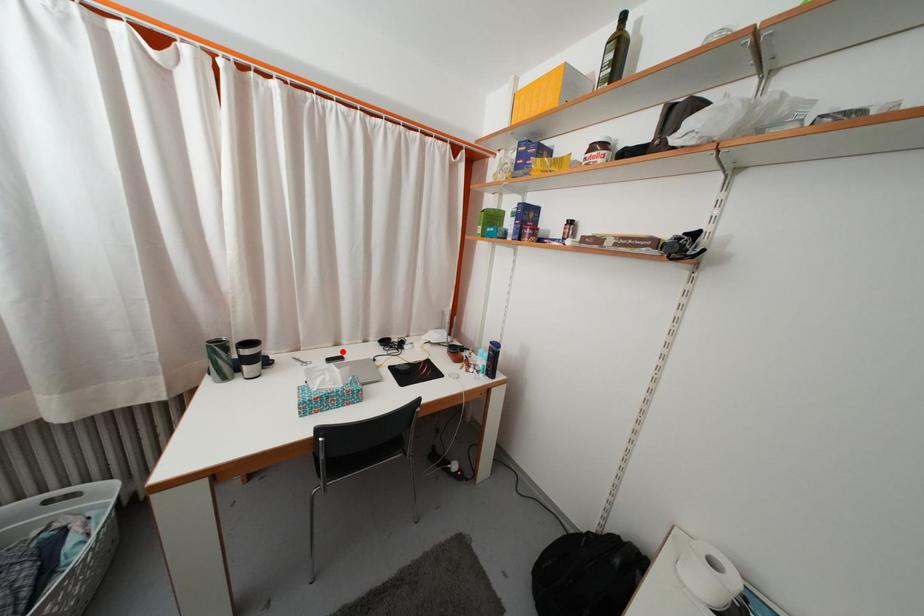
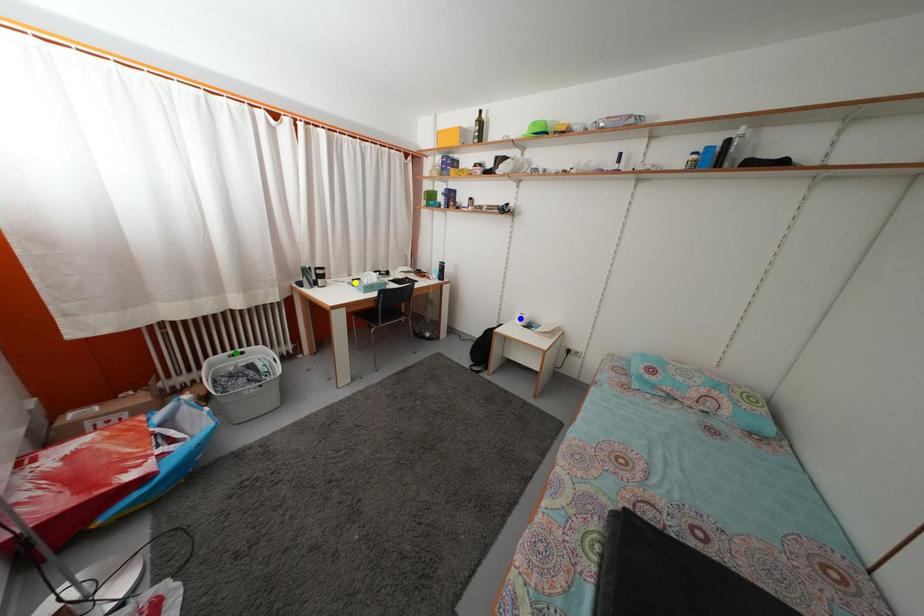
Question: I am providing you with two images of the same scene from different viewpoints. A red point is marked on the first image. You are given multiple points on the second image. In image 2, which mark is for the same physical point as the one in image 1?

Choices:
 (A) green point
 (B) blue point
 (C) yellow point

Answer: (C)